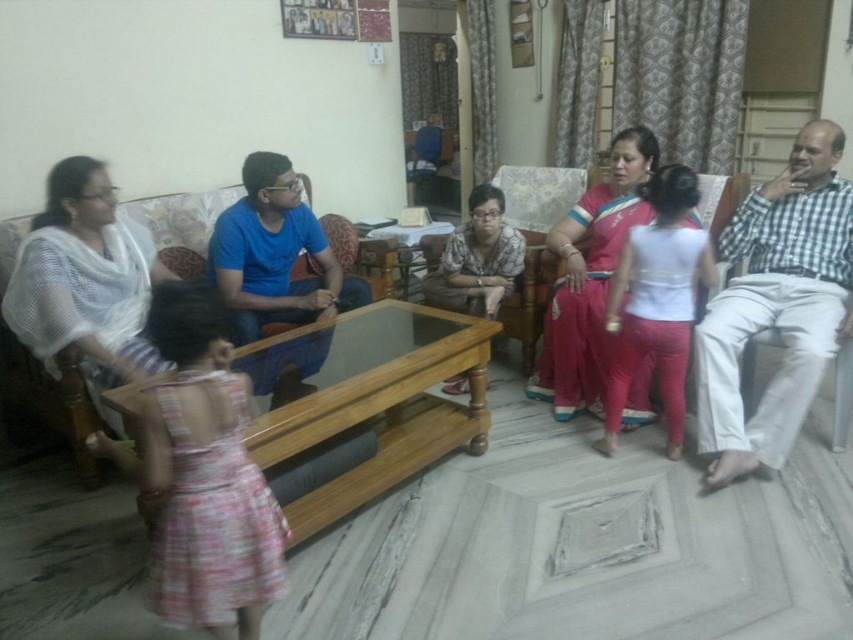
Which is more to the left, white cotton shirt at right or matte floral dress at center?

Positioned to the left is matte floral dress at center.

Find the location of `white cotton shirt at right`. white cotton shirt at right is located at coordinates (776, 305).

Which is behind, point (654, 268) or point (496, 298)?

The point (496, 298) is more distant.

Is white cotton blouse at center wider than matte floral dress at center?

Incorrect, white cotton blouse at center's width does not surpass matte floral dress at center's.

Which is behind, point (683, 170) or point (450, 294)?

Positioned behind is point (450, 294).

You are a GUI agent. You are given a task and a screenshot of the screen. Output one action in this format:
    pyautogui.click(x=<x>, y=<y>)
    Task: Click on the white cotton blouse at center
    
    Given the screenshot: What is the action you would take?
    pyautogui.click(x=657, y=301)

Is white sheer fabric at left to the left of matte floral dress at center from the viewer's perspective?

Correct, you'll find white sheer fabric at left to the left of matte floral dress at center.

Is point (56, 285) closer to camera compared to point (428, 285)?

Yes, it is in front of point (428, 285).

Does point (115, 246) lie in front of point (463, 248)?

Yes, it is.

Locate an element on the screen. This screenshot has height=640, width=853. white sheer fabric at left is located at coordinates (85, 282).